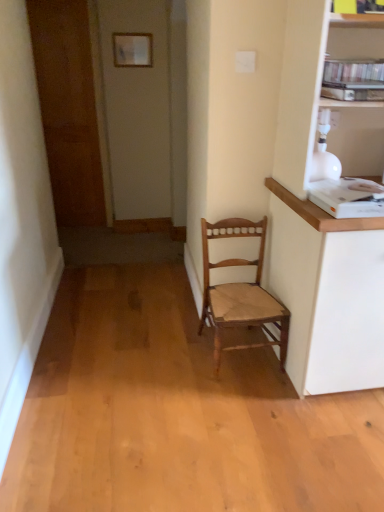
The image size is (384, 512). Find the location of `free space in front of wooden chair at center`. free space in front of wooden chair at center is located at coordinates (251, 403).